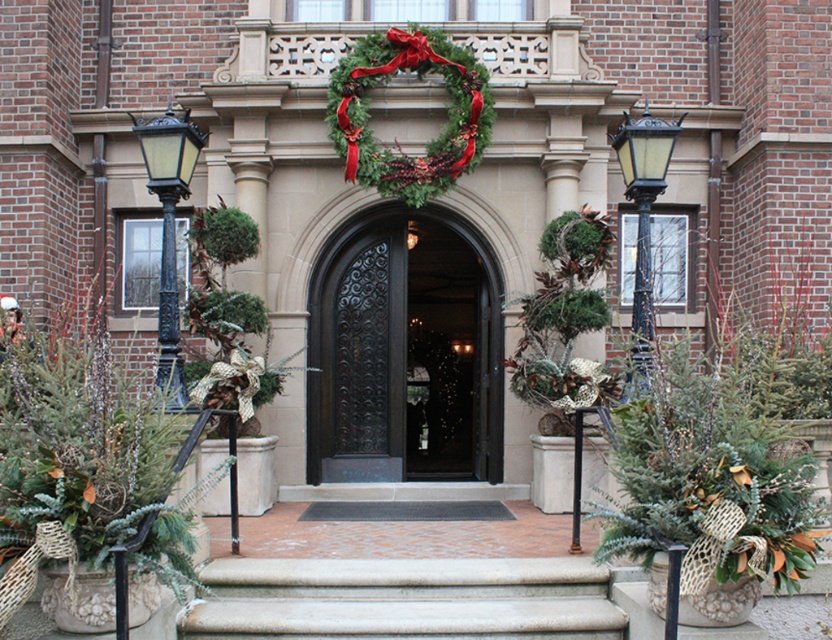
Question: Which point is farther to the camera?

Choices:
 (A) black wrought iron door at center
 (B) green leafy wreath at center
 (C) dark polished wood door at center

Answer: (A)

Question: Is black wrought iron door at center wider than green leafy wreath at center?

Choices:
 (A) no
 (B) yes

Answer: (A)

Question: Estimate the real-world distances between objects in this image. Which object is farther from the concrete steps at center?

Choices:
 (A) dark polished wood door at center
 (B) green leafy wreath at center
 (C) black wrought iron door at center

Answer: (C)

Question: Which point appears farthest from the camera in this image?

Choices:
 (A) (429, 179)
 (B) (418, 228)
 (C) (439, 465)

Answer: (C)

Question: In this image, where is dark polished wood door at center located relative to green leafy wreath at center?

Choices:
 (A) below
 (B) above

Answer: (A)

Question: Is black wrought iron door at center to the right of green leafy wreath at center from the viewer's perspective?

Choices:
 (A) yes
 (B) no

Answer: (A)